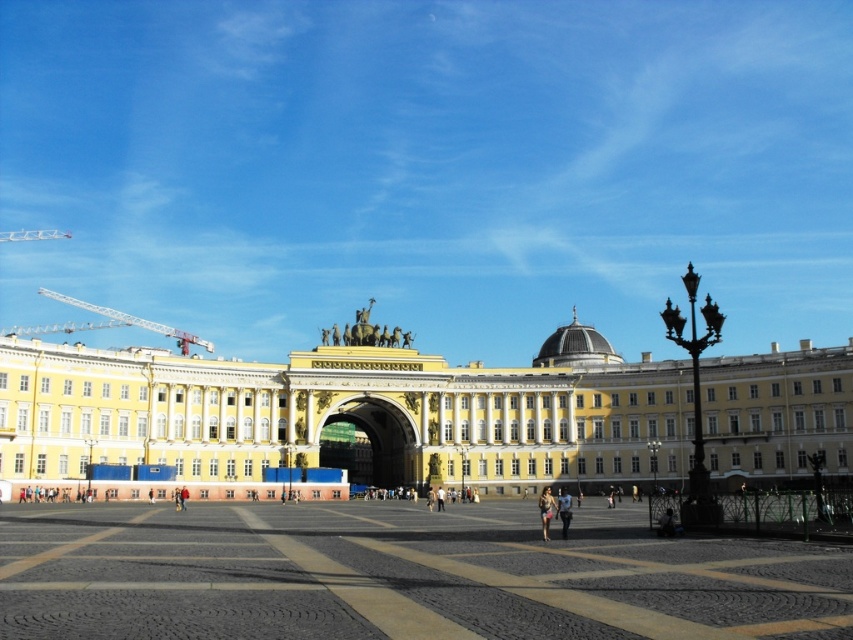
Is point (27, 236) more distant than point (567, 502)?

Yes, it is behind point (567, 502).

Is white metal crane at upper left further to camera compared to light brown leather jacket at center?

That is True.

Is point (45, 230) closer to viewer compared to point (560, 516)?

That is False.

Where is `white metal crane at upper left`? This screenshot has width=853, height=640. white metal crane at upper left is located at coordinates (32, 234).

Is denim shorts at lower center to the left of light brown leather jacket at center from the viewer's perspective?

Indeed, denim shorts at lower center is positioned on the left side of light brown leather jacket at center.

Is denim shorts at lower center wider than light brown leather jacket at center?

In fact, denim shorts at lower center might be narrower than light brown leather jacket at center.

I want to click on denim shorts at lower center, so click(546, 509).

Is metallic construction crane at left to the right of light brown leather jacket at center from the viewer's perspective?

No, metallic construction crane at left is not to the right of light brown leather jacket at center.

Between point (200, 342) and point (566, 515), which one is positioned behind?

Point (200, 342)

What do you see at coordinates (134, 321) in the screenshot? This screenshot has height=640, width=853. I see `metallic construction crane at left` at bounding box center [134, 321].

The image size is (853, 640). I want to click on metallic construction crane at left, so click(x=134, y=321).